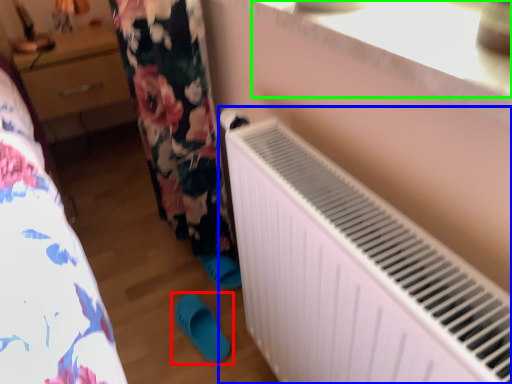
Question: Considering the real-world distances, which object is farthest from footwear (highlighted by a red box)? radiator (highlighted by a blue box) or window sill (highlighted by a green box)?

Choices:
 (A) radiator
 (B) window sill

Answer: (B)